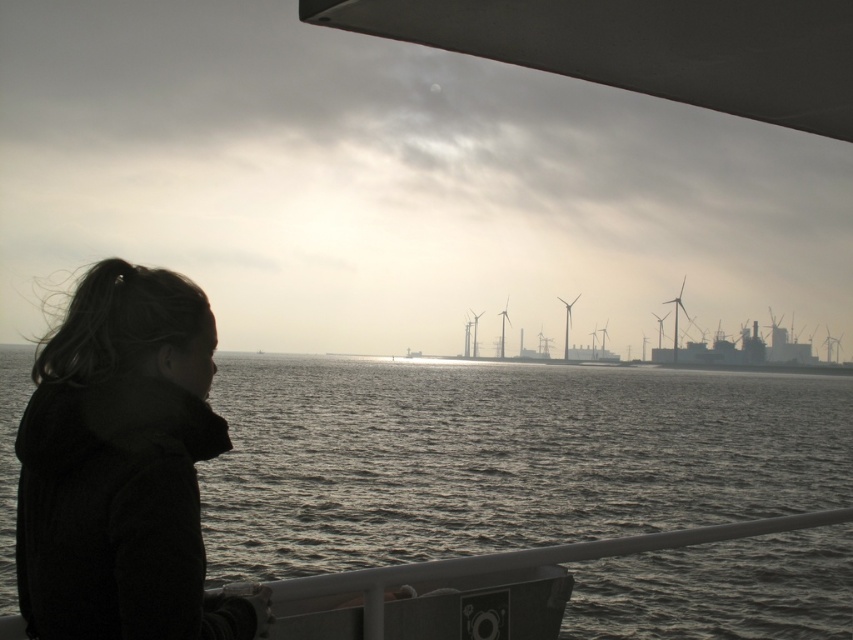
You are standing on the deck of a boat and see the gray matte water at lower center and the dark woolen jacket at left. Which object is positioned more to the left?

The gray matte water at lower center is positioned more to the left than the dark woolen jacket at left because according to the description, the gray matte water at lower center is to the left of dark woolen jacket at left.

You are standing on the deck of a boat and see the gray matte water at lower center and the dark woolen jacket at left. Which object takes up more space in the scene?

The gray matte water at lower center takes up more space in the scene than the dark woolen jacket at left because it is larger in size.